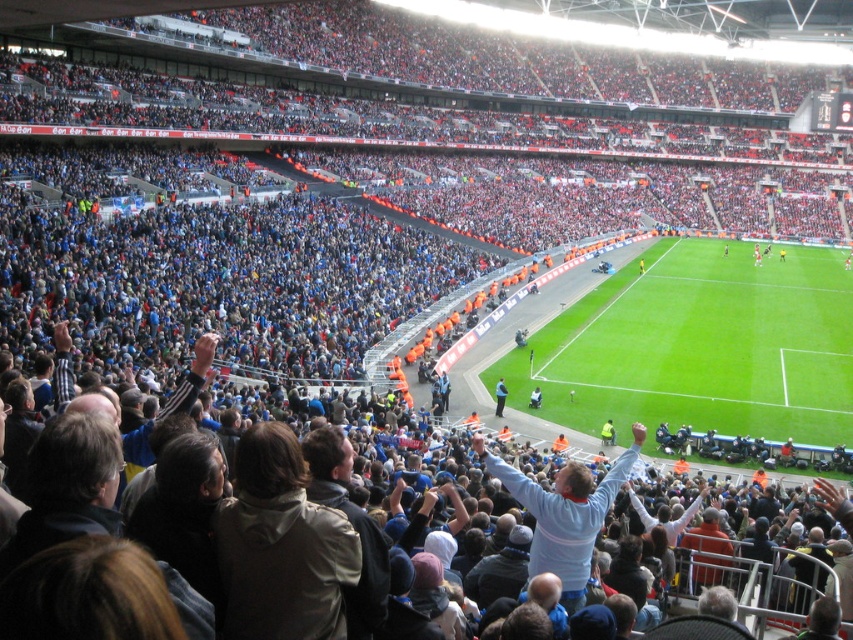
You are a drone operator trying to capture aerial footage of the football match. Your camera is currently positioned above the point marked at coordinates (701, 346). What primary feature of the scene will your camera be focusing on?

The point at coordinates (701, 346) marks the green grass football field at center, so the camera will be focusing on the football field at center.

You are a photographer at the stadium and want to take a picture that includes both the green grass football field at center and the light blue jersey at center. Based on their positions, which object should be placed on the right side of the photo to ensure both are visible?

The green grass football field at center is positioned on the right side of the light blue jersey at center, so to include both in the photo, the green grass football field at center should be on the right side of the photo.

You are a photographer standing at the center of the stadium field. You want to take a photo of both the point at coordinates point (810, 323) and point (556, 518). Which point is closer to your current position?

Point (556, 518) is closer to your current position because it is closer to the camera than point (810, 323).